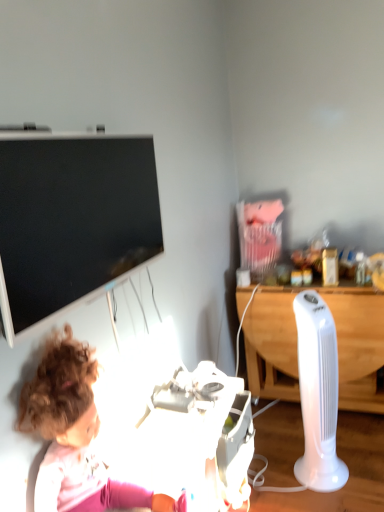
You are a GUI agent. You are given a task and a screenshot of the screen. Output one action in this format:
    pyautogui.click(x=<x>, y=<y>)
    Task: Click on the free spot above white plastic toy at lower center, which is counted as the first equipment, starting from the left (from a real-world perspective)
    The width and height of the screenshot is (384, 512).
    Given the screenshot: What is the action you would take?
    pyautogui.click(x=183, y=431)